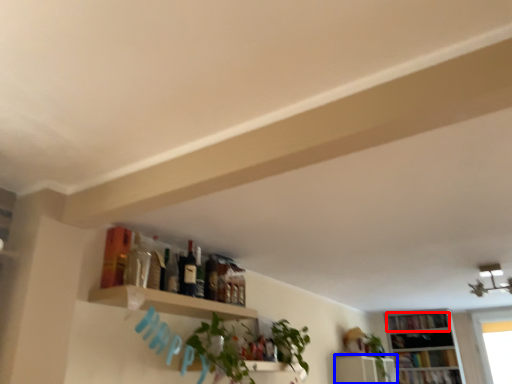
Question: Which of the following is the closest to the observer, book (highlighted by a red box) or shelf (highlighted by a blue box)?

Choices:
 (A) book
 (B) shelf

Answer: (B)